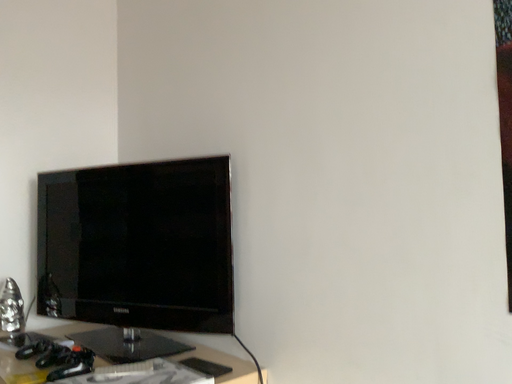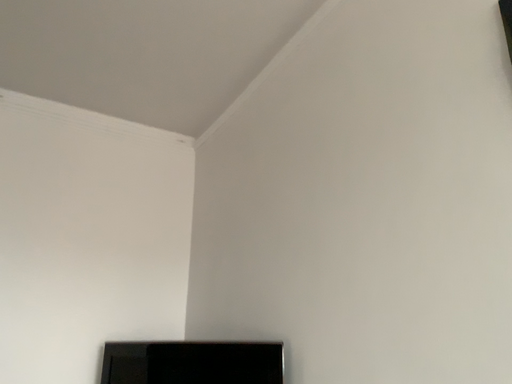
Question: Which way did the camera rotate in the video?

Choices:
 (A) rotated downward
 (B) rotated upward

Answer: (B)